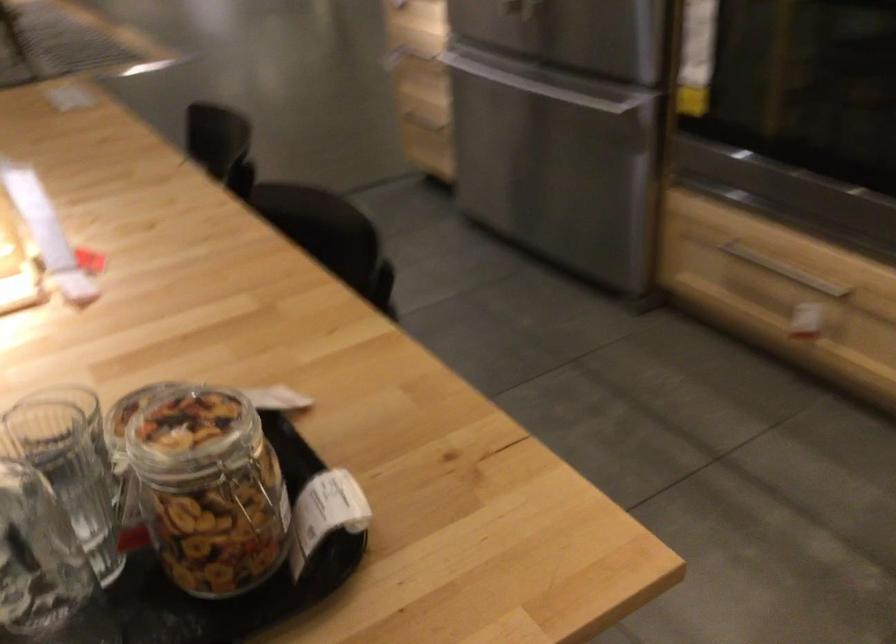
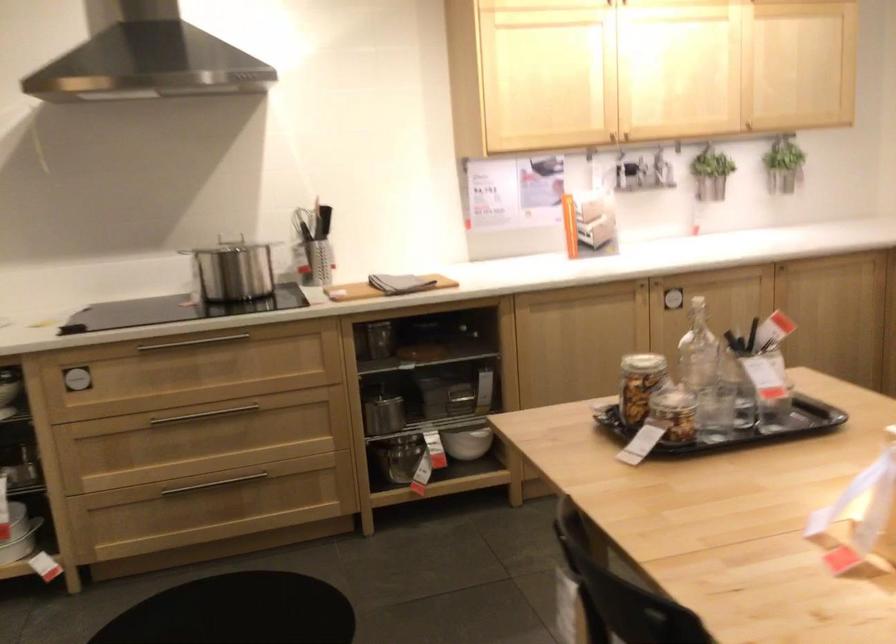
Question: I am providing you with two images of the same scene from different viewpoints. After the viewpoint changes to image2, which objects are now occluded?

Choices:
 (A) pot lid handle
 (B) case of water bottles
 (C) utensil holder
 (D) jar metal clasp

Answer: (D)